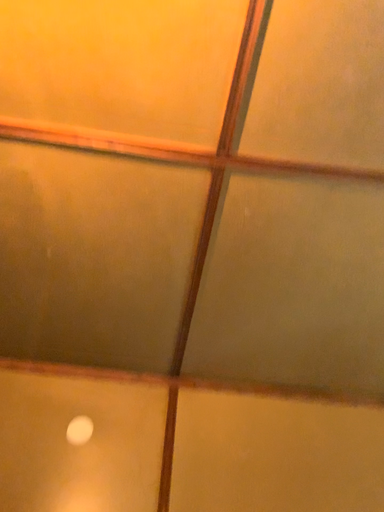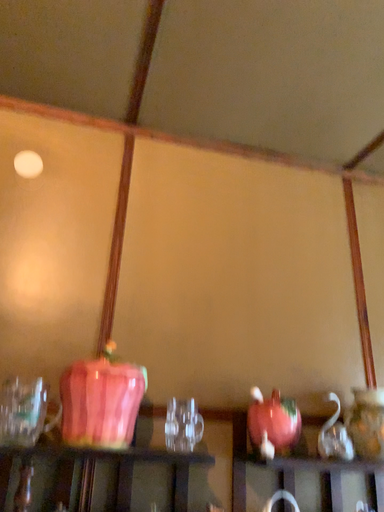
Question: How did the camera likely rotate when shooting the video?

Choices:
 (A) rotated upward
 (B) rotated downward

Answer: (B)